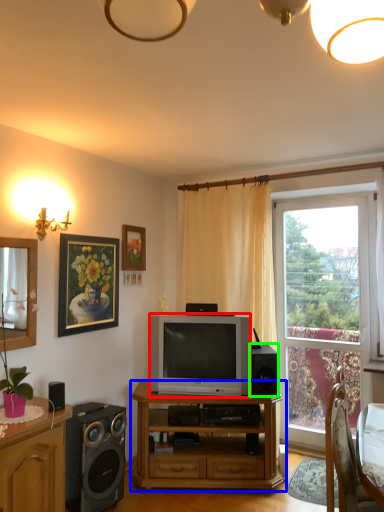
Question: Which is farther away from television (highlighted by a red box)? desk (highlighted by a blue box) or speaker (highlighted by a green box)?

Choices:
 (A) desk
 (B) speaker

Answer: (A)